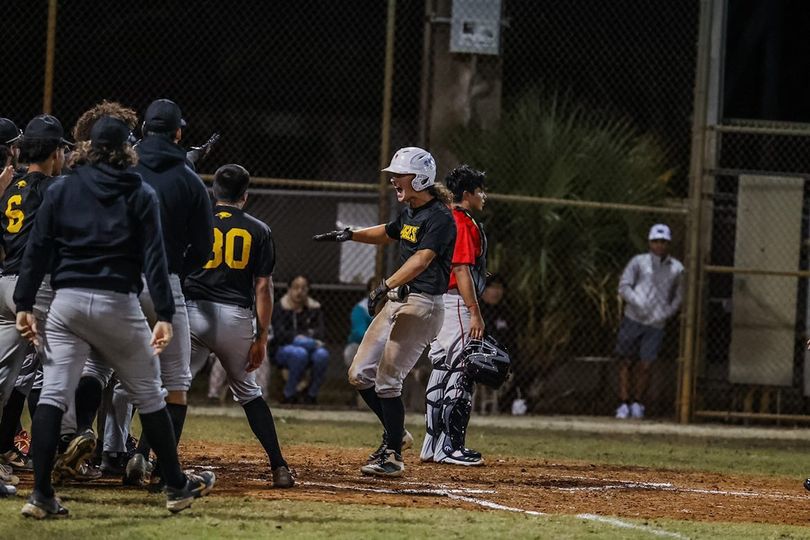
This screenshot has height=540, width=810. Identify the location of plant. (544, 239).